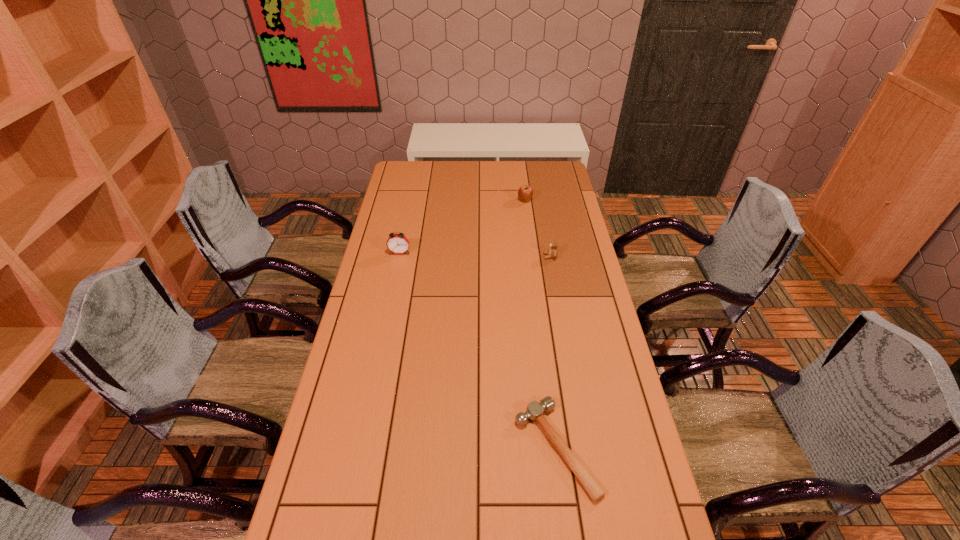
You are a GUI agent. You are given a task and a screenshot of the screen. Output one action in this format:
    pyautogui.click(x=<x>, y=<y>)
    Task: Click on the free spot between the teddy bear and the farthest object
    Image resolution: width=960 pixels, height=540 pixels.
    Given the screenshot: What is the action you would take?
    pyautogui.click(x=538, y=228)

The height and width of the screenshot is (540, 960). In order to click on empty location between the alarm clock and the hammer in this screenshot , I will do `click(477, 350)`.

I want to click on empty space that is in between the farthest object and the hammer, so click(540, 324).

You are a GUI agent. You are given a task and a screenshot of the screen. Output one action in this format:
    pyautogui.click(x=<x>, y=<y>)
    Task: Click on the vacant space in between the apple and the teddy bear
    The height and width of the screenshot is (540, 960).
    Given the screenshot: What is the action you would take?
    pyautogui.click(x=538, y=228)

Where is `vacant area that lies between the leftmost object and the apple`? The image size is (960, 540). vacant area that lies between the leftmost object and the apple is located at coordinates (463, 227).

The width and height of the screenshot is (960, 540). In order to click on free space between the alarm clock and the nearest object in this screenshot , I will do `click(477, 350)`.

Identify the location of empty space between the apple and the tallest object. (463, 227).

Choose which object is the nearest neighbor to the tallest object. Please provide its 2D coordinates. Your answer should be formatted as a tuple, i.e. [(x, y)], where the tuple contains the x and y coordinates of a point satisfying the conditions above.

[(553, 252)]

Identify the location of the second closest object to the teddy bear. (397, 243).